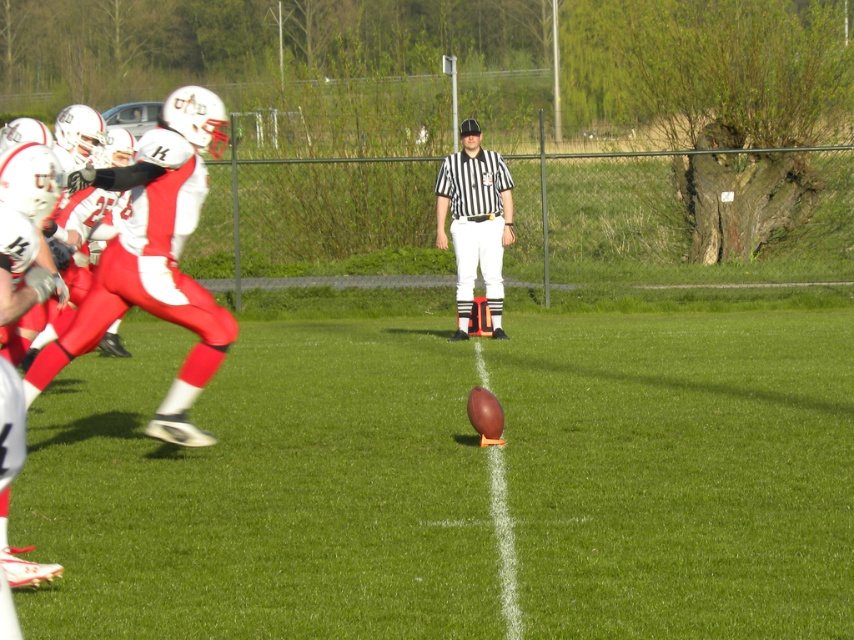
How much distance is there between brown leather football at center and black striped shirt at center?

A distance of 3.39 meters exists between brown leather football at center and black striped shirt at center.

Is brown leather football at center above black striped shirt at center?

Actually, brown leather football at center is below black striped shirt at center.

Locate an element on the screen. brown leather football at center is located at coordinates (265, 492).

You are a GUI agent. You are given a task and a screenshot of the screen. Output one action in this format:
    pyautogui.click(x=<x>, y=<y>)
    Task: Click on the brown leather football at center
    The width and height of the screenshot is (854, 640).
    Given the screenshot: What is the action you would take?
    pyautogui.click(x=265, y=492)

Is brown leather football at center behind white matte uniform at left?

No, brown leather football at center is in front of white matte uniform at left.

Which of these two, brown leather football at center or white matte uniform at left, stands shorter?

brown leather football at center is shorter.

Between point (746, 536) and point (184, 362), which one is positioned in front?

Point (746, 536) is in front.

Where is `brown leather football at center`? The image size is (854, 640). brown leather football at center is located at coordinates (265, 492).

The width and height of the screenshot is (854, 640). Describe the element at coordinates (155, 259) in the screenshot. I see `white matte uniform at left` at that location.

Is white matte uniform at left bigger than black striped shirt at center?

Indeed, white matte uniform at left has a larger size compared to black striped shirt at center.

Which is behind, point (143, 145) or point (439, 198)?

Point (439, 198)

Image resolution: width=854 pixels, height=640 pixels. I want to click on white matte uniform at left, so click(x=155, y=259).